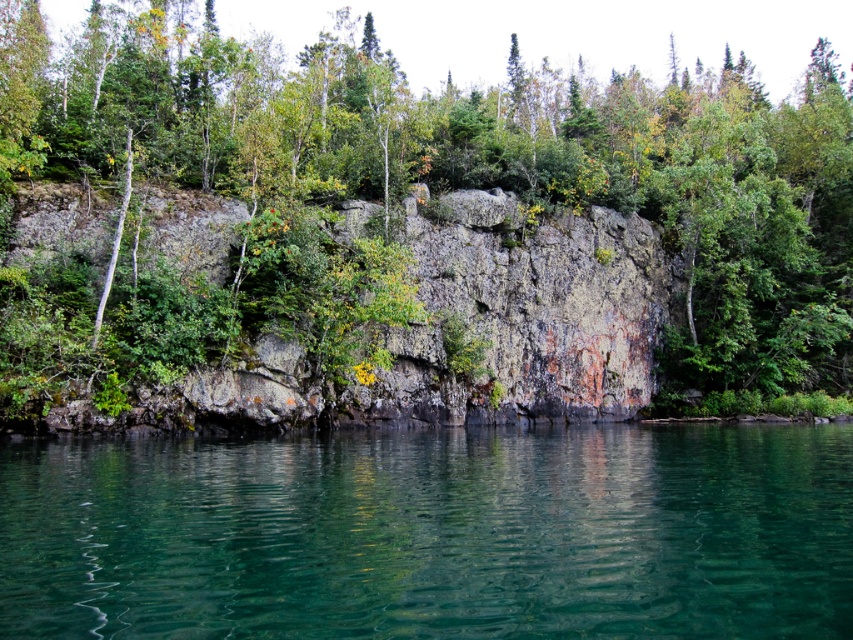
You are standing at the base of the cliff and want to reach the green leafy tree at upper center. Given that the cliff is 100 feet tall, can you climb directly to the tree?

The distance between the green leafy tree at upper center and the viewer is 113.58 feet, which is greater than the cliff height of 100 feet. Therefore, you cannot climb directly to the tree as it is further away horizontally than the vertical height of the cliff.

You are a kayaker planning to navigate between the clear glass water at center and the rusty stone cliff at center. Which direction should you paddle to avoid hitting the cliff?

You should paddle to the right to avoid hitting the rusty stone cliff at center because the clear glass water at center is located to the left of the cliff.